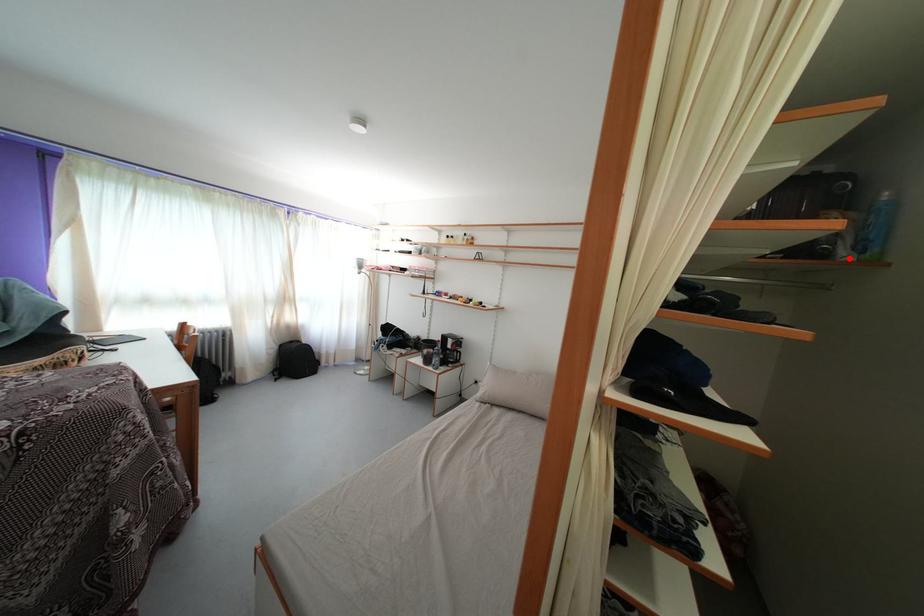
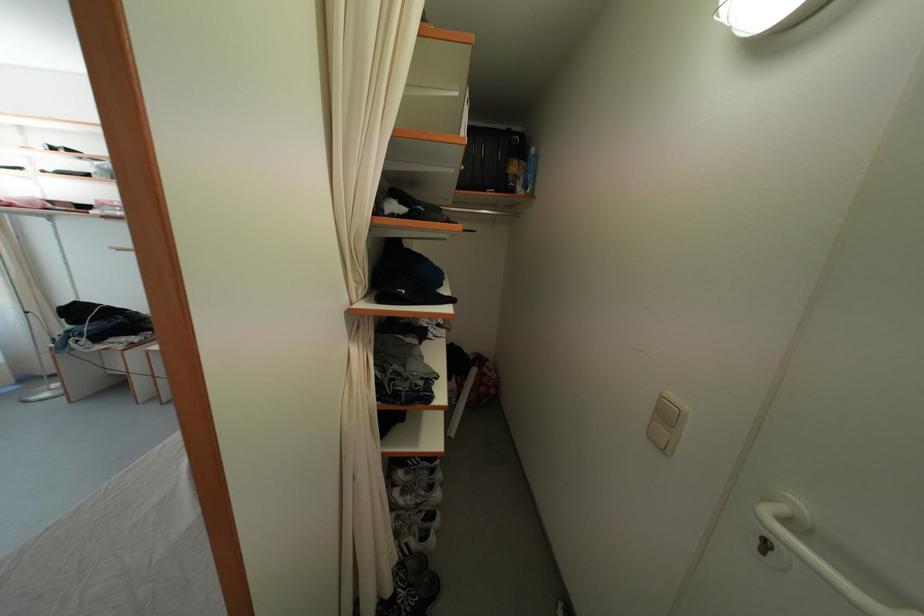
Where in the second image is the point corresponding to the highlighted location from the first image?

(525, 195)